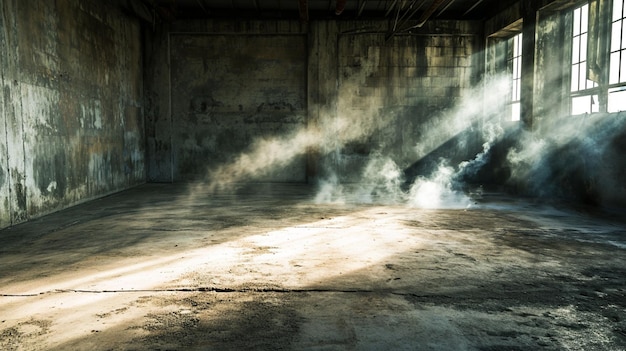
Locate an element on the screen. Image resolution: width=626 pixels, height=351 pixels. fabric is located at coordinates (597, 52).